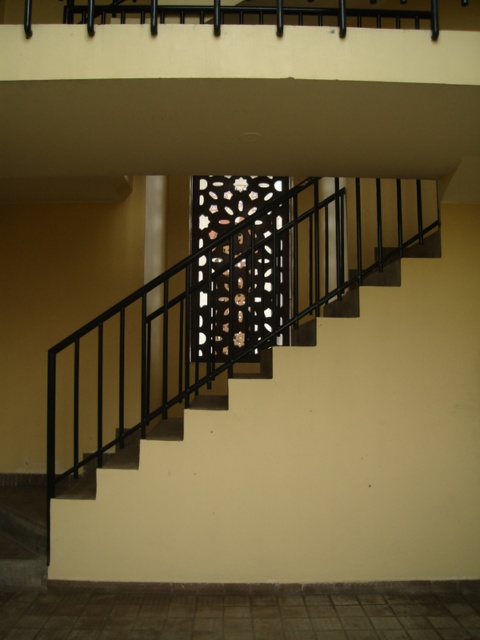
This screenshot has width=480, height=640. What do you see at coordinates (155, 227) in the screenshot? I see `white glossy pillar at center` at bounding box center [155, 227].

Can you confirm if white glossy pillar at center is taller than black metal/iron pillar at center?

Yes.

Who is more forward, (162, 378) or (328, 246)?

Point (328, 246)

What are the coordinates of `white glossy pillar at center` in the screenshot? It's located at (155, 227).

Does black metal balustrade at upper center lie behind white glossy pillar at center?

That is False.

Is black metal balustrade at upper center thinner than white glossy pillar at center?

No.

In the scene shown: Who is more forward, (440, 8) or (162, 252)?

Point (440, 8) is more forward.

Find the location of a particular element. black metal balustrade at upper center is located at coordinates (385, 12).

Between black metal stairs at center and white glossy pillar at center, which one appears on the right side from the viewer's perspective?

white glossy pillar at center is more to the right.

Locate an element on the screen. The image size is (480, 640). black metal stairs at center is located at coordinates (84, 467).

The height and width of the screenshot is (640, 480). What do you see at coordinates (84, 467) in the screenshot? I see `black metal stairs at center` at bounding box center [84, 467].

Where is `black metal stairs at center`? This screenshot has height=640, width=480. black metal stairs at center is located at coordinates (84, 467).